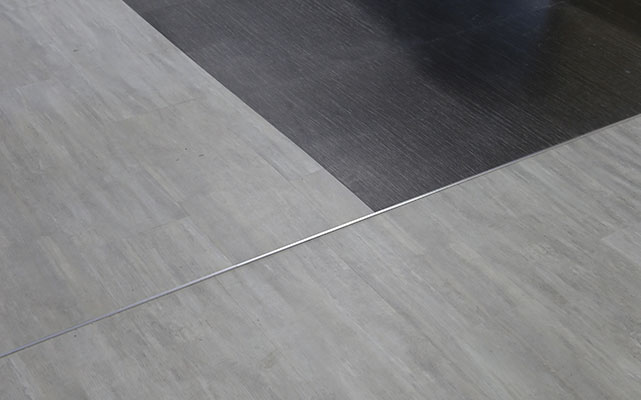
What are the coordinates of `line between gray flooring and dark flooring` in the screenshot? It's located at (306, 152).